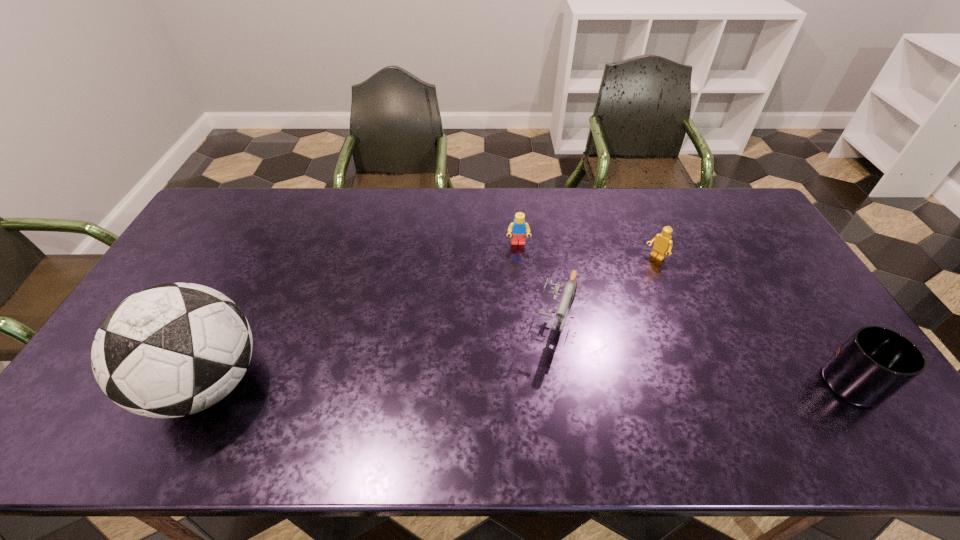
The width and height of the screenshot is (960, 540). I want to click on free spot on the desktop that is between the tallest object and the rightmost object and is positioned at the barrel end of the gun, so pos(538,383).

Image resolution: width=960 pixels, height=540 pixels. I want to click on vacant spot on the desktop that is between the tallest object and the rightmost object and is positioned on the face of the nearer Lego, so click(511, 383).

The height and width of the screenshot is (540, 960). Identify the location of vacant spot on the desktop that is between the tallest object and the mug and is positioned on the front-facing side of the farthest object. (528, 383).